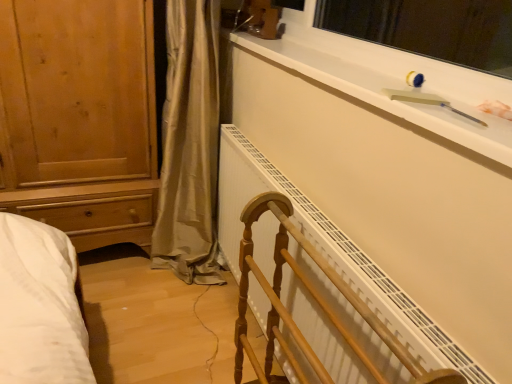
Question: From their relative heights in the image, would you say white plastic window screen at upper right is taller or shorter than white matte window sill at upper right?

Choices:
 (A) short
 (B) tall

Answer: (B)

Question: Considering the relative positions of white plastic window screen at upper right and white matte window sill at upper right in the image provided, is white plastic window screen at upper right to the left or to the right of white matte window sill at upper right?

Choices:
 (A) left
 (B) right

Answer: (B)

Question: Which of these objects is positioned closest to the wooden towel rack at center?

Choices:
 (A) white matte window sill at upper right
 (B) white plastic window screen at upper right

Answer: (A)

Question: Which object is positioned farthest from the white matte window sill at upper right?

Choices:
 (A) wooden towel rack at center
 (B) white plastic window screen at upper right

Answer: (B)